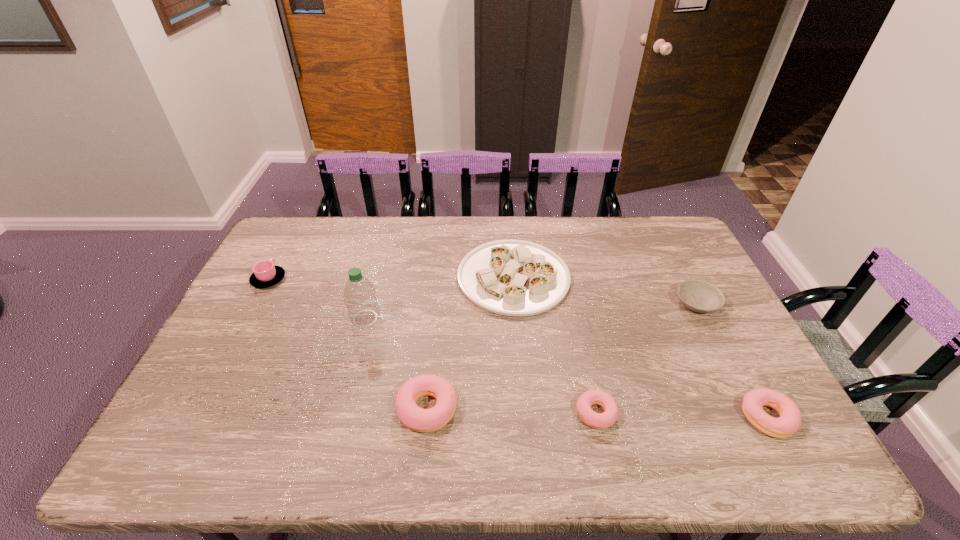
The image size is (960, 540). I want to click on bowl located in the right edge section of the desktop, so click(699, 296).

The width and height of the screenshot is (960, 540). What are the coordinates of `object present at the near right corner` in the screenshot? It's located at (789, 422).

Locate an element on the screen. This screenshot has height=540, width=960. vacant space at the far edge is located at coordinates 571,228.

The height and width of the screenshot is (540, 960). I want to click on free point at the near edge, so click(x=396, y=414).

Locate an element on the screen. free space at the left edge of the desktop is located at coordinates (238, 315).

Identify the location of vacant region at the right edge of the desktop. (684, 270).

Identify the location of blank region between the tallest doughnut and the bowl. The height and width of the screenshot is (540, 960). (562, 356).

Find the location of a particular element. vacant region between the bowl and the rightmost doughnut is located at coordinates (732, 360).

The width and height of the screenshot is (960, 540). Identify the location of blank region between the water bottle and the second tallest doughnut. (566, 368).

Identify the location of empty location between the bowl and the second doughnut from right to left. This screenshot has height=540, width=960. (646, 359).